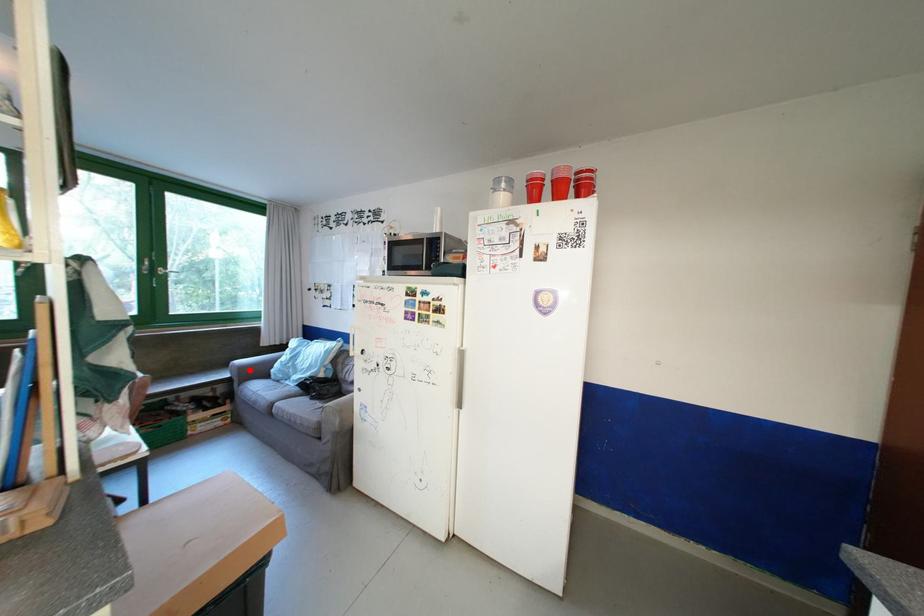
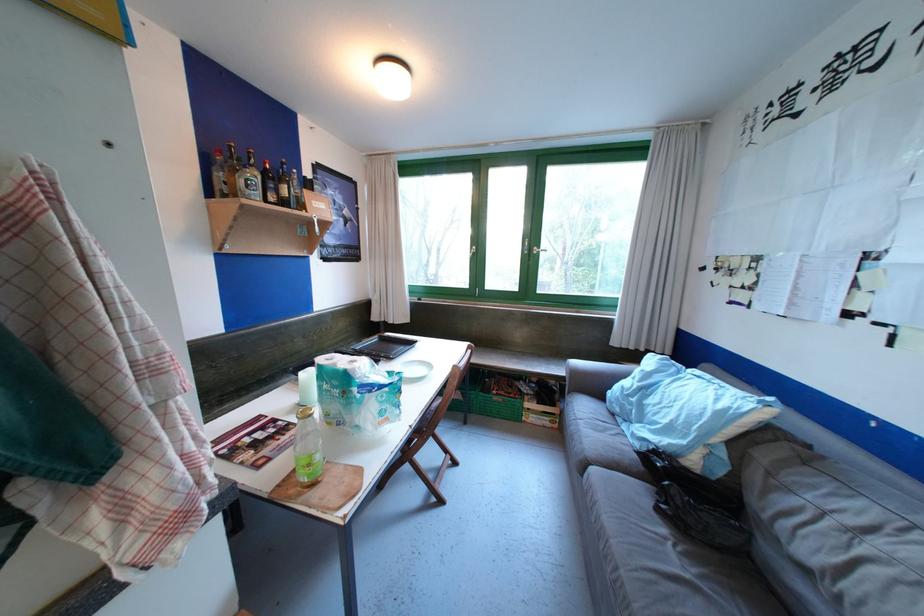
Question: I am providing you with two images of the same scene from different viewpoints. In image1, a red point is highlighted. Considering the same 3D point in image2, which of the following is correct?

Choices:
 (A) It is closer
 (B) It is farther

Answer: (A)